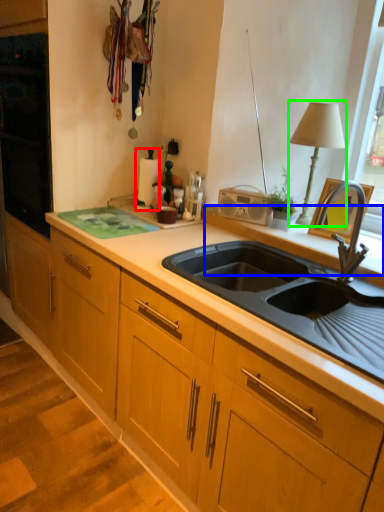
Question: Based on their relative distances, which object is farther from appliance (highlighted by a red box)? Choose from window sill (highlighted by a blue box) and table lamp (highlighted by a green box).

Choices:
 (A) window sill
 (B) table lamp

Answer: (B)